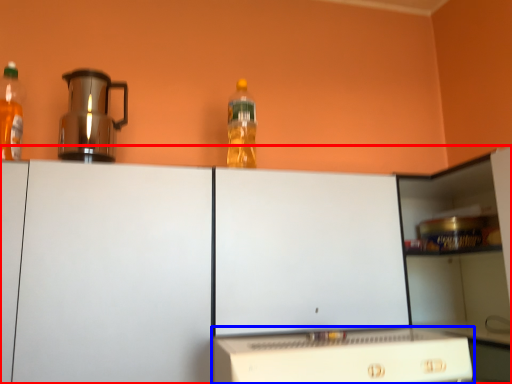
Question: Which point is further to the camera, cabinetry (highlighted by a red box) or home appliance (highlighted by a blue box)?

Choices:
 (A) cabinetry
 (B) home appliance

Answer: (A)